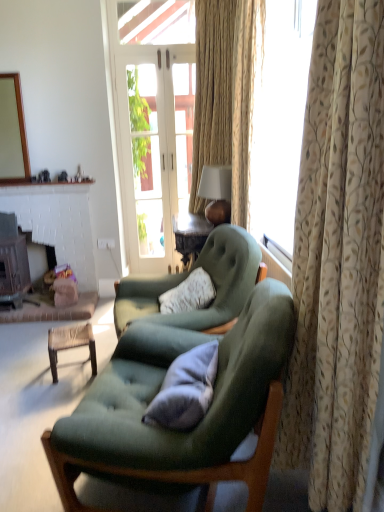
Question: Relative to woven brown stool at lower left, is green matte mirror at upper left in front or behind?

Choices:
 (A) behind
 (B) front

Answer: (A)

Question: Considering the positions of green matte mirror at upper left and woven brown stool at lower left in the image, is green matte mirror at upper left taller or shorter than woven brown stool at lower left?

Choices:
 (A) short
 (B) tall

Answer: (B)

Question: Considering the real-world distances, which object is closest to the white brick fireplace at lower left, the first fireplace in the right-to-left sequence?

Choices:
 (A) clear glass door at center
 (B) dark brown wood fireplace at left, the 2th fireplace viewed from the right
 (C) matte gold lampshade at center
 (D) gray fabric pillow at center
 (E) velvet green armchair at center, arranged as the second chair when viewed from the front

Answer: (B)

Question: Estimate the real-world distances between objects in this image. Which object is farther from the green matte mirror at upper left?

Choices:
 (A) white brick fireplace at lower left, placed as the second fireplace when sorted from left to right
 (B) woven brown stool at lower left
 (C) velvet green sofa at center, placed as the 1th chair when sorted from front to back
 (D) dark brown wood fireplace at left, the 2th fireplace viewed from the right
 (E) beige textured curtain at right, marked as the second curtain in a front-to-back arrangement

Answer: (C)